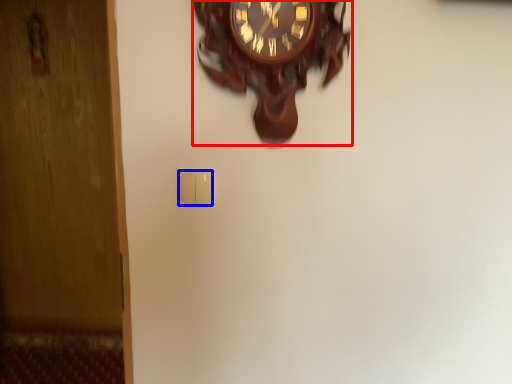
Question: Which object is further to the camera taking this photo, wall clock (highlighted by a red box) or light switch (highlighted by a blue box)?

Choices:
 (A) wall clock
 (B) light switch

Answer: (B)